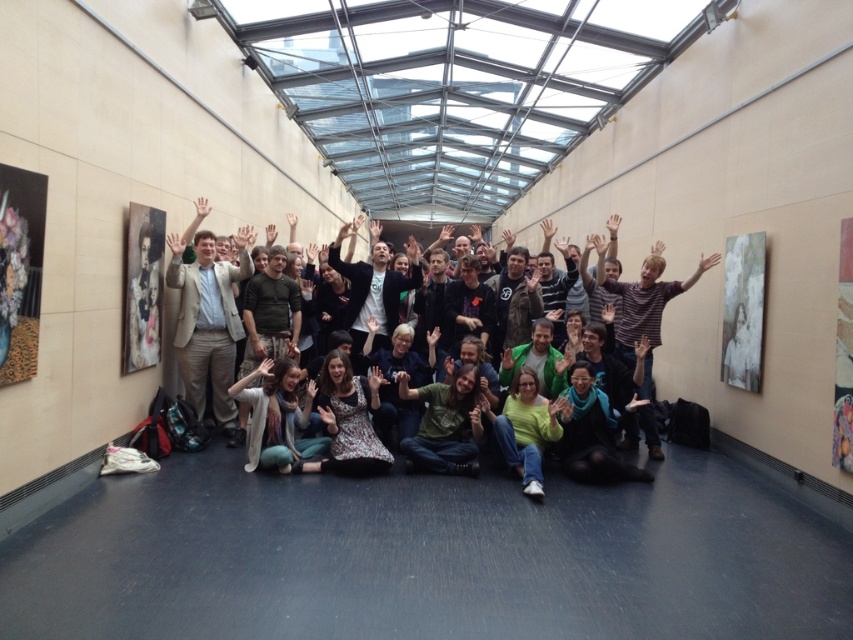
In the scene shown: You are a photographer taking a group photo in a gallery with a matte black jacket at center and a green jersey at center. Which clothing item is covering the other one?

The matte black jacket at center is positioned over the green jersey at center, so it is covering the green jersey at center.